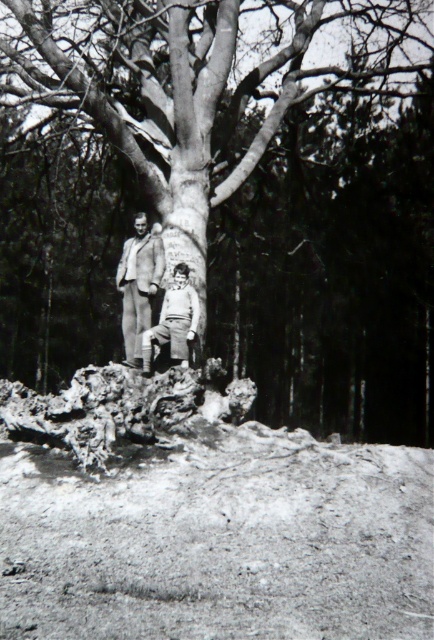
Question: Can you confirm if light brown wool coat at center is bigger than light brown fabric pants at center?

Choices:
 (A) no
 (B) yes

Answer: (B)

Question: Which object is positioned closest to the light brown wool coat at center?

Choices:
 (A) light brown fabric pants at center
 (B) smooth bark tree trunk at center

Answer: (A)

Question: Is smooth bark tree trunk at center closer to the viewer compared to light brown wool coat at center?

Choices:
 (A) yes
 (B) no

Answer: (B)

Question: Estimate the real-world distances between objects in this image. Which object is farther from the dull brown dirt at lower center?

Choices:
 (A) light brown wool coat at center
 (B) smooth bark tree trunk at center

Answer: (B)

Question: Estimate the real-world distances between objects in this image. Which object is farther from the light brown wool coat at center?

Choices:
 (A) smooth bark tree trunk at center
 (B) dull brown dirt at lower center
 (C) light brown fabric pants at center

Answer: (A)

Question: Can you confirm if dull brown dirt at lower center is positioned above light brown wool coat at center?

Choices:
 (A) yes
 (B) no

Answer: (B)